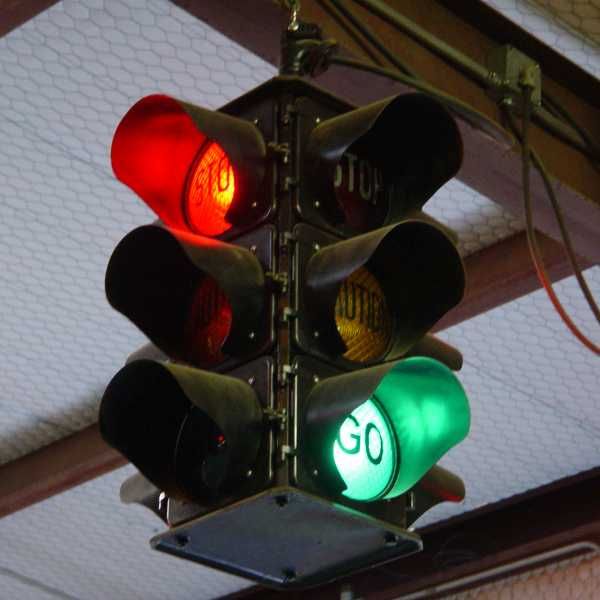
Identify the location of ceiling. (73, 75).